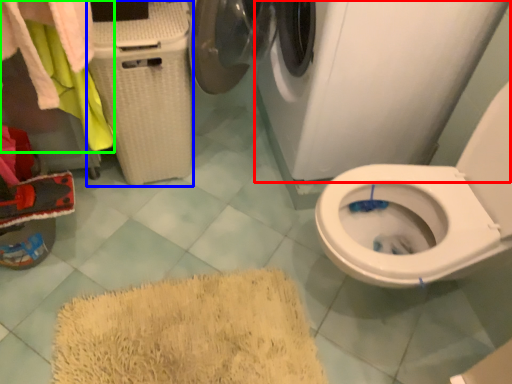
Question: Considering the real-world distances, which object is closest to washing machine (highlighted by a red box)? laundry basket (highlighted by a blue box) or laundry (highlighted by a green box).

Choices:
 (A) laundry basket
 (B) laundry

Answer: (A)